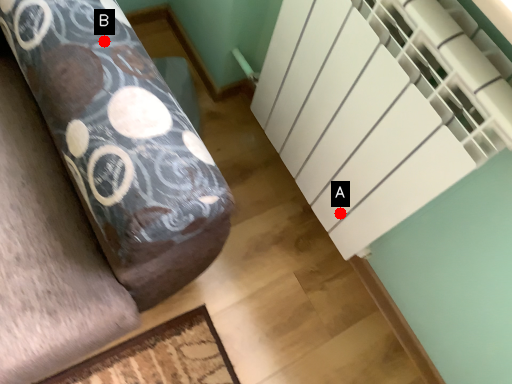
Question: Two points are circled on the image, labeled by A and B beside each circle. Which point is closer to the camera?

Choices:
 (A) A is closer
 (B) B is closer

Answer: (B)